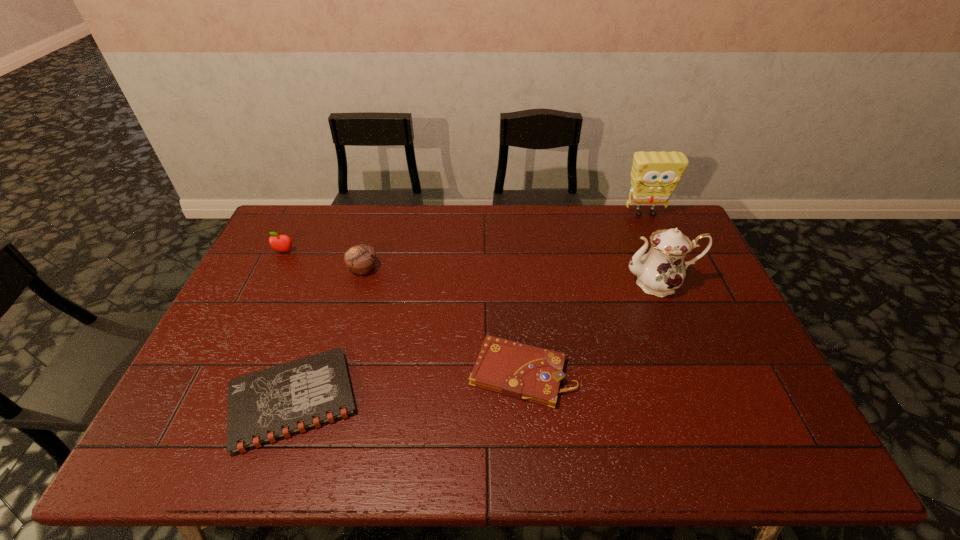
The width and height of the screenshot is (960, 540). Find the location of `sponge`. sponge is located at coordinates (655, 175).

Locate an element on the screen. The width and height of the screenshot is (960, 540). chinaware is located at coordinates (659, 272).

In order to click on muffin in this screenshot , I will do `click(361, 258)`.

Find the location of `apple`. apple is located at coordinates (282, 243).

At what (x,y) coordinates should I click in order to perform the action: click on the taller notebook. Please return your answer as a coordinate pair (x, y). The width and height of the screenshot is (960, 540). Looking at the image, I should click on (521, 371).

This screenshot has height=540, width=960. In order to click on the third object from right to left in this screenshot , I will do `click(521, 371)`.

In order to click on the shorter notebook in this screenshot , I will do [265, 406].

At what (x,y) coordinates should I click in order to perform the action: click on the shortest object. Please return your answer as a coordinate pair (x, y). The width and height of the screenshot is (960, 540). Looking at the image, I should click on (265, 406).

Locate an element on the screen. blank space located 0.300m on the face of the farthest object is located at coordinates (674, 279).

I want to click on free space located on the front of the chinaware, so click(x=680, y=335).